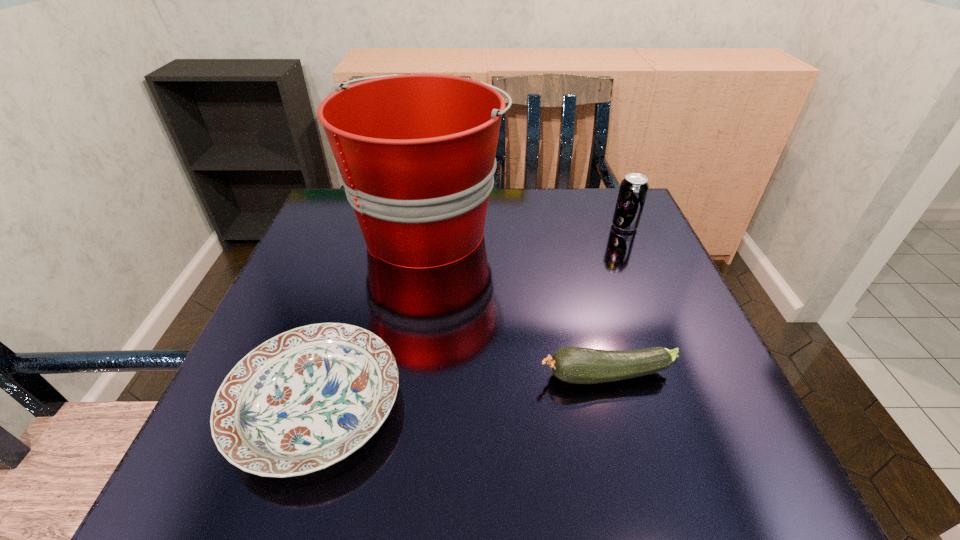
Where is `bucket`? The width and height of the screenshot is (960, 540). bucket is located at coordinates (416, 153).

This screenshot has width=960, height=540. Identify the location of soda can. (633, 190).

At what (x,y) coordinates should I click in order to perform the action: click on the third tallest object. Please return your answer as a coordinate pair (x, y). The width and height of the screenshot is (960, 540). Looking at the image, I should click on (576, 365).

You are a GUI agent. You are given a task and a screenshot of the screen. Output one action in this format:
    pyautogui.click(x=<x>, y=<y>)
    Task: Click on the plate
    
    Given the screenshot: What is the action you would take?
    pyautogui.click(x=309, y=397)

Image resolution: width=960 pixels, height=540 pixels. I want to click on free space located 0.390m on the front of the bucket, so click(393, 463).

Locate an element on the screen. free space located on the front of the third shortest object is located at coordinates (663, 315).

Find the location of a particular element. This screenshot has height=540, width=960. blank area located at the blossom end of the third tallest object is located at coordinates (354, 376).

Identify the location of free space located 0.060m at the blossom end of the third tallest object. (503, 376).

This screenshot has height=540, width=960. In order to click on vacant area situated 0.080m at the blossom end of the third tallest object in this screenshot , I will do `click(491, 376)`.

This screenshot has width=960, height=540. I want to click on free space located on the back of the shortest object, so click(373, 225).